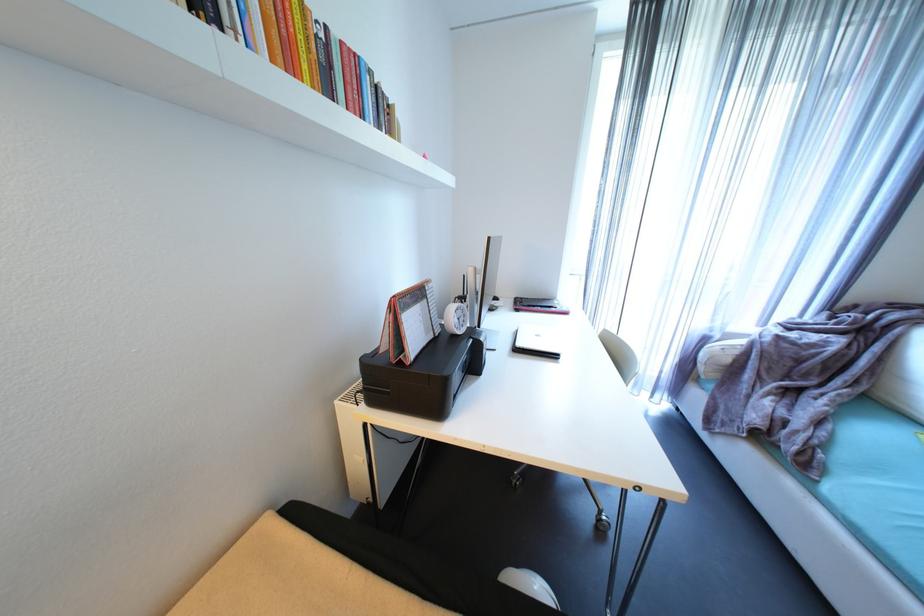
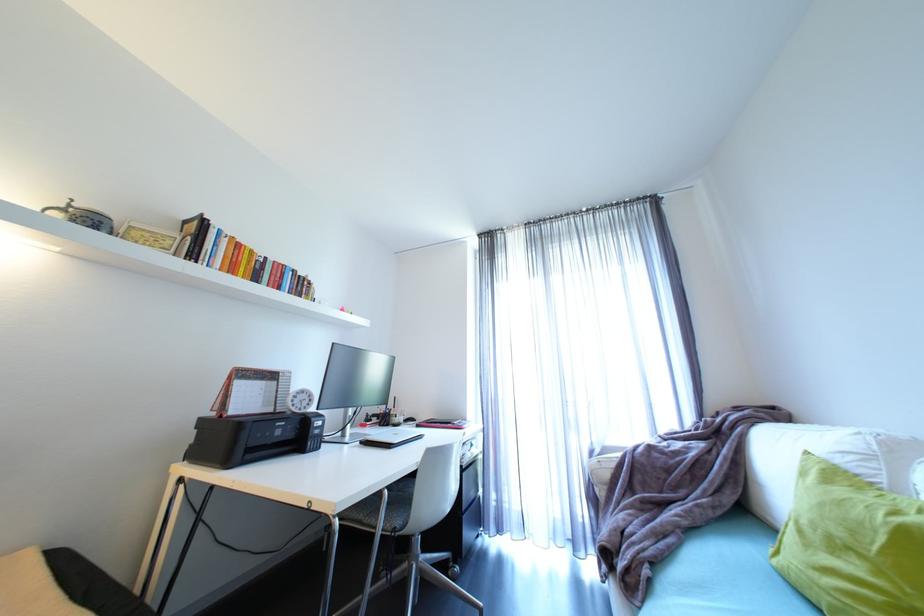
The point at (558,307) is marked in the first image. Where is the corresponding point in the second image?

(457, 424)